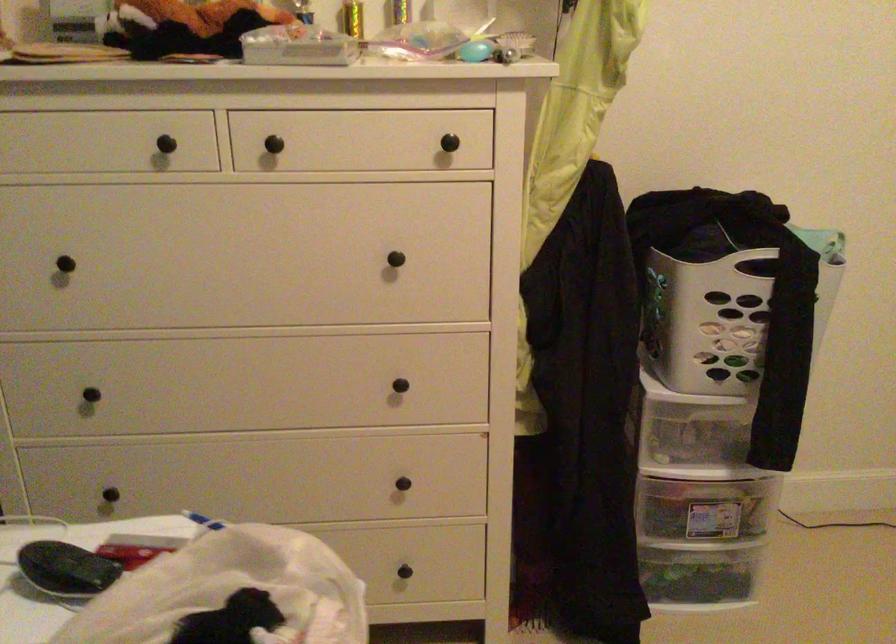
Locate an element on the screen. black computer mouse is located at coordinates (65, 569).